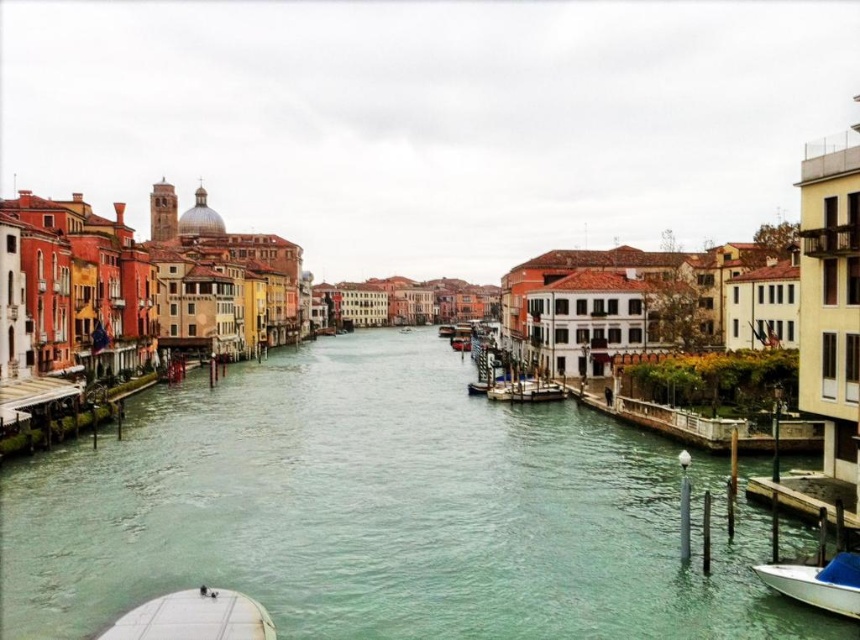
Looking at this image, is wooden dock at center positioned at the back of wooden boat at center?

No, it is not.

Is wooden dock at center bigger than wooden boat at center?

No, wooden dock at center is not bigger than wooden boat at center.

This screenshot has width=860, height=640. What do you see at coordinates (525, 390) in the screenshot? I see `wooden dock at center` at bounding box center [525, 390].

This screenshot has height=640, width=860. Identify the location of wooden dock at center. (525, 390).

Is point (259, 493) positioned in front of point (808, 582)?

No, (259, 493) is behind (808, 582).

Can you confirm if greenish water at center is bigger than white matte boat at lower right?

Yes, greenish water at center is bigger than white matte boat at lower right.

Does point (809, 621) come behind point (848, 598)?

Yes, it is behind point (848, 598).

Find the location of a particular element. greenish water at center is located at coordinates pyautogui.click(x=382, y=513).

The height and width of the screenshot is (640, 860). What are the coordinates of `greenish water at center` in the screenshot? It's located at (382, 513).

Who is positioned more to the right, greenish water at center or wooden boat at center?

From the viewer's perspective, wooden boat at center appears more on the right side.

Where is `greenish water at center`? The image size is (860, 640). greenish water at center is located at coordinates (382, 513).